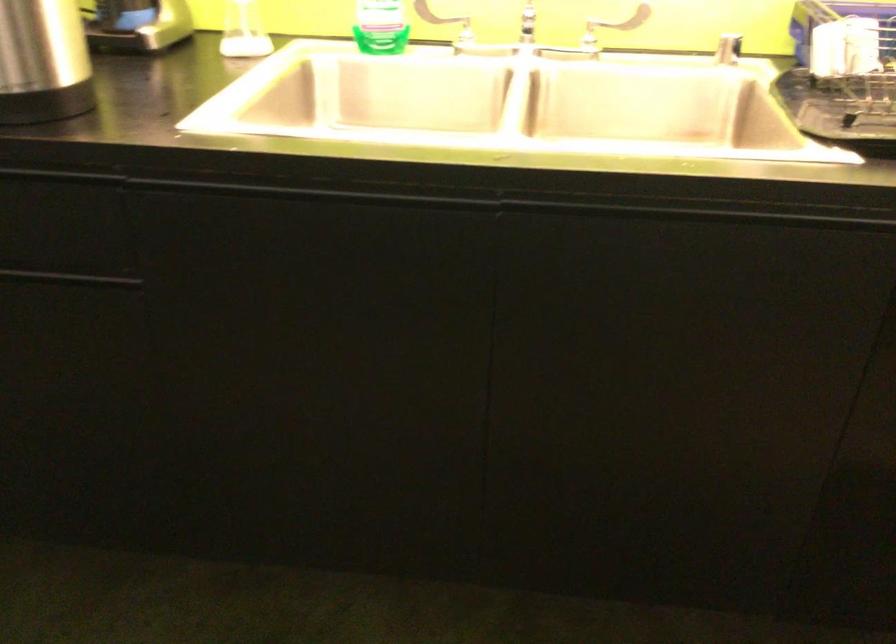
Find where to push the white dispenser pump. Please return your answer as a coordinate pair (x, y).

(244, 33)